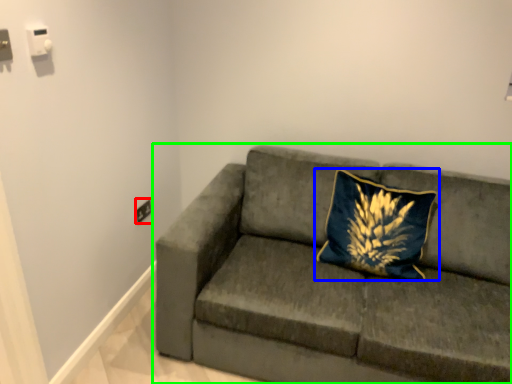
Question: Based on their relative distances, which object is farther from electric outlet (highlighted by a red box)? Choose from pillow (highlighted by a blue box) and studio couch (highlighted by a green box).

Choices:
 (A) pillow
 (B) studio couch

Answer: (A)